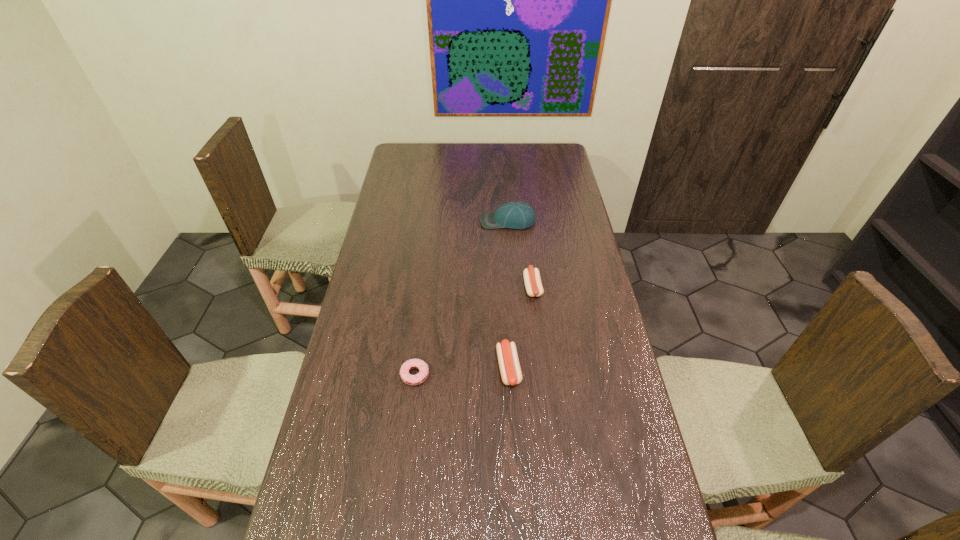
This screenshot has height=540, width=960. Identify the location of baseball cap. (516, 215).

Locate an element on the screen. This screenshot has height=540, width=960. the farthest object is located at coordinates (516, 215).

Image resolution: width=960 pixels, height=540 pixels. I want to click on the second farthest object, so click(532, 279).

Identify the location of the right sausage. The image size is (960, 540). (532, 279).

Locate an element on the screen. the left sausage is located at coordinates (509, 365).

You are a GUI agent. You are given a task and a screenshot of the screen. Output one action in this format:
    pyautogui.click(x=<x>, y=<y>)
    Task: Click on the shortest object
    The width and height of the screenshot is (960, 540).
    Given the screenshot: What is the action you would take?
    pyautogui.click(x=412, y=380)

You are a GUI agent. You are given a task and a screenshot of the screen. Output one action in this format:
    pyautogui.click(x=<x>, y=<y>)
    Task: Click on the doughnut
    
    Given the screenshot: What is the action you would take?
    pyautogui.click(x=412, y=380)

This screenshot has height=540, width=960. Find the location of `free location located 0.200m on the left of the baseball cap`. free location located 0.200m on the left of the baseball cap is located at coordinates (430, 221).

Find the location of `vacant space positioned on the front of the right sausage`. vacant space positioned on the front of the right sausage is located at coordinates (541, 363).

Identify the location of vacant point located on the left of the nearer sausage. This screenshot has height=540, width=960. (417, 368).